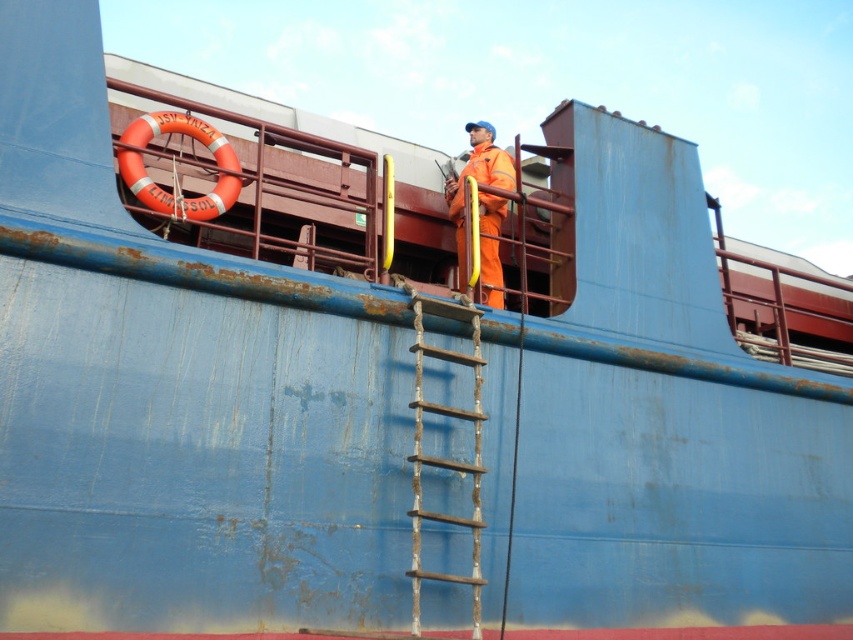
Between rusty wood ladder at center and orange matte safety suit at center, which one is positioned higher?

orange matte safety suit at center

Can you confirm if rusty wood ladder at center is thinner than orange matte safety suit at center?

Indeed, rusty wood ladder at center has a lesser width compared to orange matte safety suit at center.

Identify the location of rusty wood ladder at center. The height and width of the screenshot is (640, 853). (444, 458).

Is orange matte safety suit at center smaller than orange matte life jacket at upper center?

No.

Is orange matte safety suit at center in front of orange matte life jacket at upper center?

That is True.

Between point (485, 180) and point (505, 176), which one is positioned in front?

Point (505, 176) is in front.

The image size is (853, 640). I want to click on orange matte safety suit at center, so click(476, 180).

Who is positioned more to the left, rusty wood ladder at center or orange matte life jacket at upper center?

From the viewer's perspective, rusty wood ladder at center appears more on the left side.

Based on the photo, does rusty wood ladder at center have a larger size compared to orange matte life jacket at upper center?

Yes.

Is point (421, 406) closer to viewer compared to point (483, 202)?

Yes, point (421, 406) is in front of point (483, 202).

Identify the location of rusty wood ladder at center. (444, 458).